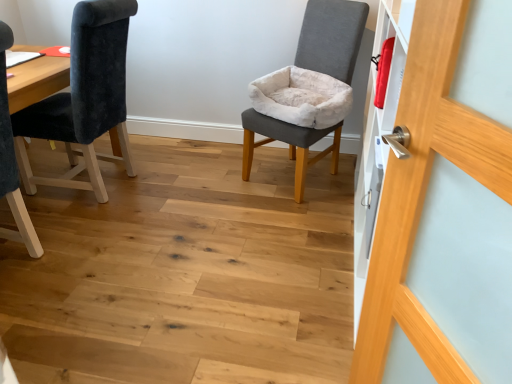
Locate an element on the screen. vacant space positioned to the left of gray fabric chair at center, placed as the 2th chair when sorted from left to right is located at coordinates (217, 180).